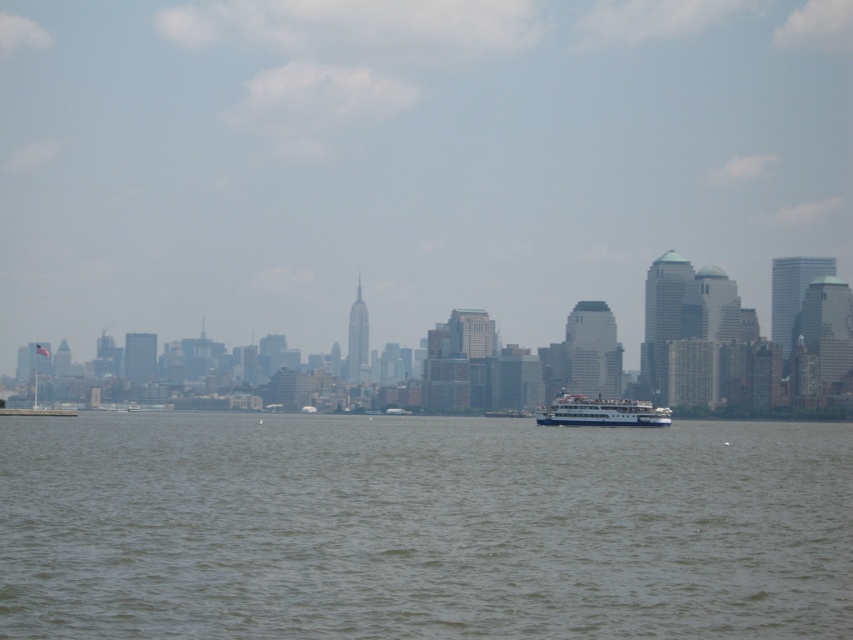
You are standing at the edge of the water and want to throw a stone into the brown water at center. If your throwing range is 300 meters, will you be able to reach it?

The brown water at center is 302.03 meters away from camera, so no, you cannot reach it with a 300 meter throwing range.

You are standing at the edge of the water in the scene. There is a point marked at coordinates (421, 528). What is the color of the water at that specific point?

The water at point (421, 528) is brown.

You are a photographer trying to capture the entire scene of the brown water at center and the white glossy ferry at center in one shot. Based on their sizes in the image, which object would require you to adjust your camera settings to ensure both are properly framed and in focus?

The brown water at center is larger in size than the white glossy ferry at center, so you would need to adjust your camera settings to accommodate the larger brown water at center to ensure both are properly framed and in focus.